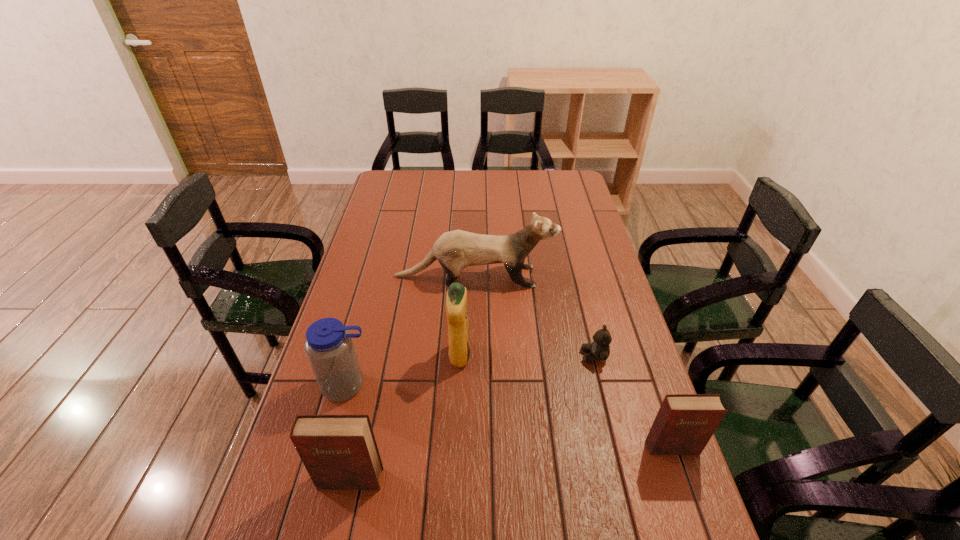
Locate an element on the screen. This screenshot has height=540, width=960. vacant space that's between the teddy bear and the detergent is located at coordinates (527, 356).

You are a GUI agent. You are given a task and a screenshot of the screen. Output one action in this format:
    pyautogui.click(x=<x>, y=<y>)
    Task: Click on the empty space that is in between the detergent and the fifth farthest object
    The width and height of the screenshot is (960, 540).
    Given the screenshot: What is the action you would take?
    pyautogui.click(x=565, y=402)

At what (x,y) coordinates should I click in order to perform the action: click on free point between the water bottle and the second nearest object. Please return your answer as a coordinate pair (x, y). Looking at the image, I should click on (510, 416).

The image size is (960, 540). I want to click on blank region between the ferret and the fifth object from left to right, so click(x=535, y=316).

Identify the location of vacant area between the water bottle and the fifth object from left to right. (470, 370).

You are a GUI agent. You are given a task and a screenshot of the screen. Output one action in this format:
    pyautogui.click(x=<x>, y=<y>)
    Task: Click on the third closest object to the teddy bear
    
    Given the screenshot: What is the action you would take?
    click(456, 299)

You are a GUI agent. You are given a task and a screenshot of the screen. Output one action in this format:
    pyautogui.click(x=<x>, y=<y>)
    Task: Click on the object that ranks as the fifth closest to the detergent
    The image size is (960, 540).
    Given the screenshot: What is the action you would take?
    pyautogui.click(x=684, y=424)

At what (x,y) coordinates should I click in order to perform the action: click on vacant space that satisfies the following two spatial constraints: 1. on the face of the farthest object; 2. with a carrying loop on the side of the water bottle. Please return your answer as a coordinate pair (x, y). This screenshot has height=540, width=960. Looking at the image, I should click on (473, 386).

The image size is (960, 540). Find the location of `vacant area that satisfies the following two spatial constraints: 1. on the face of the teddy bear; 2. on the front cover of the nearer diary`. vacant area that satisfies the following two spatial constraints: 1. on the face of the teddy bear; 2. on the front cover of the nearer diary is located at coordinates (624, 480).

Find the location of a particular element. This screenshot has width=960, height=540. free space that satisfies the following two spatial constraints: 1. on the face of the ferret; 2. with a carrying loop on the side of the water bottle is located at coordinates (473, 386).